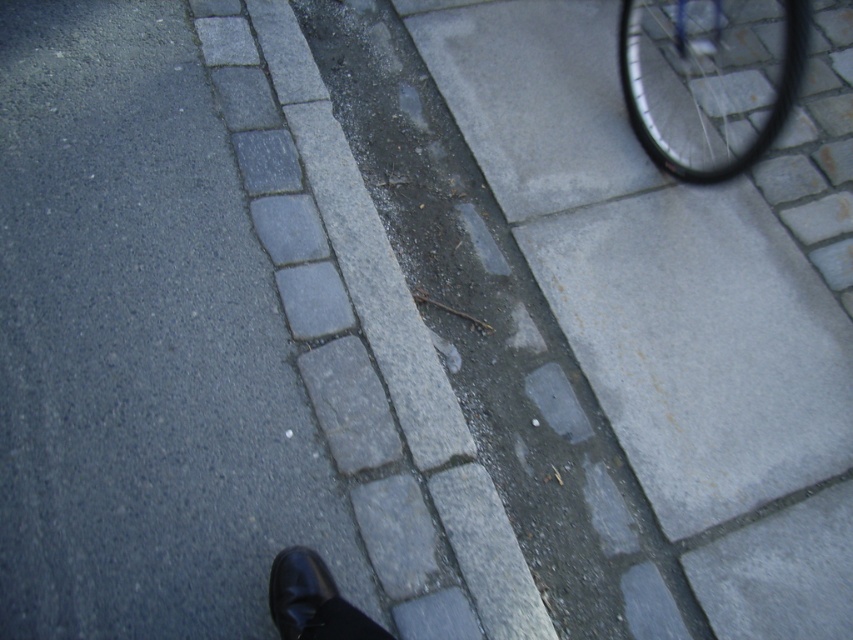
Measure the distance from gray stone curb at center to shiny metallic wheel at upper right.

A distance of 4.01 feet exists between gray stone curb at center and shiny metallic wheel at upper right.

Between gray stone curb at center and shiny metallic wheel at upper right, which one appears on the right side from the viewer's perspective?

shiny metallic wheel at upper right

This screenshot has width=853, height=640. I want to click on gray stone curb at center, so tap(364, 340).

Does gray stone curb at center have a smaller size compared to black leather shoe at lower left?

No, gray stone curb at center is not smaller than black leather shoe at lower left.

Between gray stone curb at center and black leather shoe at lower left, which one appears on the left side from the viewer's perspective?

gray stone curb at center

This screenshot has width=853, height=640. Describe the element at coordinates (364, 340) in the screenshot. I see `gray stone curb at center` at that location.

At what (x,y) coordinates should I click in order to perform the action: click on gray stone curb at center. Please return your answer as a coordinate pair (x, y). The height and width of the screenshot is (640, 853). Looking at the image, I should click on (364, 340).

Based on the photo, can you confirm if shiny metallic wheel at upper right is taller than black leather shoe at lower left?

Correct, shiny metallic wheel at upper right is much taller as black leather shoe at lower left.

In order to click on shiny metallic wheel at upper right in this screenshot , I will do `click(711, 77)`.